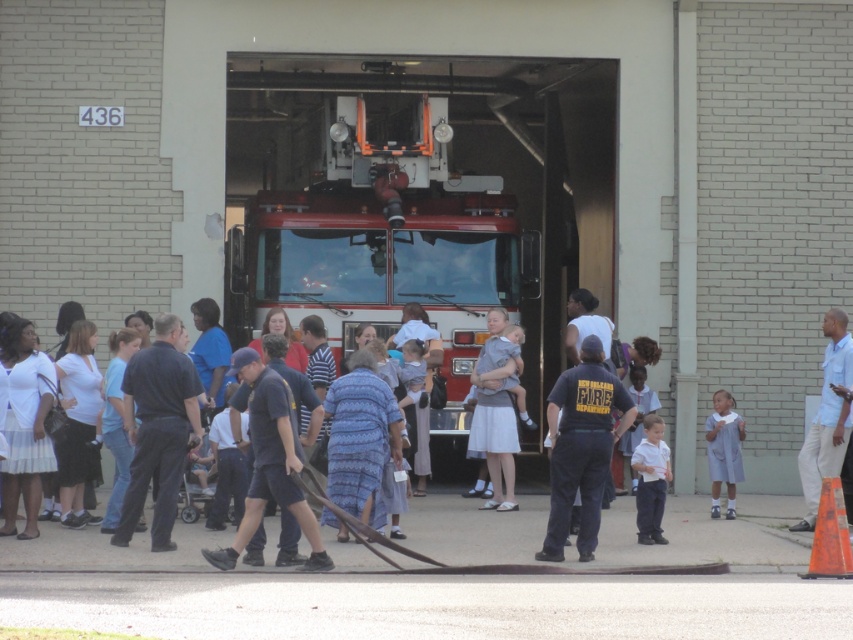
Question: Estimate the real-world distances between objects in this image. Which object is closer to the light blue fabric dress at lower right?

Choices:
 (A) white matte shirt at center
 (B) shiny red fire truck at center
 (C) dark blue uniform at center

Answer: (A)

Question: Which point is closer to the camera?

Choices:
 (A) (421, 253)
 (B) (483, 403)
 (C) (660, 467)

Answer: (C)

Question: Can you confirm if dark blue uniform at center is thinner than light blue fabric dress at center?

Choices:
 (A) no
 (B) yes

Answer: (A)

Question: Which of the following is the farthest from the observer?

Choices:
 (A) shiny red fire truck at center
 (B) dark blue uniform at center

Answer: (A)

Question: Does light blue fabric dress at center have a lesser width compared to light blue fabric dress at lower right?

Choices:
 (A) yes
 (B) no

Answer: (B)

Question: Is dark blue uniform at center to the right of light blue fabric dress at lower right from the viewer's perspective?

Choices:
 (A) no
 (B) yes

Answer: (A)